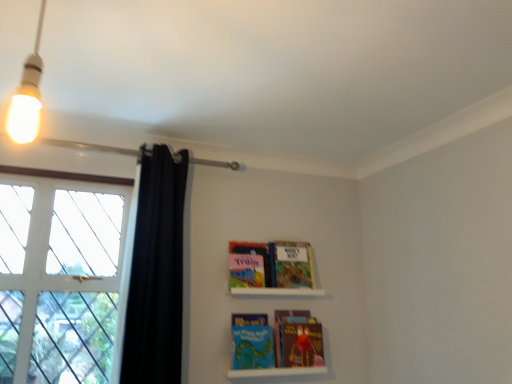
Question: Is matte plastic books at lower center, which appears as the first shelf when ordered from the bottom, far from multicolored paper at lower center, which is the first paperback book in bottom-to-top order?

Choices:
 (A) no
 (B) yes

Answer: (A)

Question: Does matte plastic books at lower center, which appears as the first shelf when ordered from the bottom, have a larger size compared to multicolored paper at lower center, which is the first paperback book in bottom-to-top order?

Choices:
 (A) no
 (B) yes

Answer: (A)

Question: Can you confirm if matte plastic books at lower center, placed as the second shelf when sorted from top to bottom, is taller than multicolored paper at lower center, acting as the fourth paperback book starting from the top?

Choices:
 (A) yes
 (B) no

Answer: (B)

Question: Considering the relative sizes of matte plastic books at lower center, which appears as the first shelf when ordered from the bottom, and multicolored paper at lower center, which is the first paperback book in bottom-to-top order, in the image provided, is matte plastic books at lower center, which appears as the first shelf when ordered from the bottom, smaller than multicolored paper at lower center, which is the first paperback book in bottom-to-top order,?

Choices:
 (A) yes
 (B) no

Answer: (A)

Question: Considering the relative sizes of matte plastic books at lower center, placed as the second shelf when sorted from top to bottom, and multicolored paper at lower center, which is the first paperback book in bottom-to-top order, in the image provided, is matte plastic books at lower center, placed as the second shelf when sorted from top to bottom, wider than multicolored paper at lower center, which is the first paperback book in bottom-to-top order,?

Choices:
 (A) no
 (B) yes

Answer: (B)

Question: Is matte blue book at center, which ranks as the fourth paperback book in bottom-to-top order, inside the boundaries of white matte shelf at upper center, the second shelf ordered from the bottom, or outside?

Choices:
 (A) inside
 (B) outside

Answer: (B)

Question: From the image's perspective, relative to white matte shelf at upper center, which is the 1th shelf from top to bottom, is matte blue book at center, which ranks as the 1th paperback book in top-to-bottom order, above or below?

Choices:
 (A) above
 (B) below

Answer: (A)

Question: From a real-world perspective, is matte blue book at center, which ranks as the 1th paperback book in top-to-bottom order, physically located above or below white matte shelf at upper center, the second shelf ordered from the bottom?

Choices:
 (A) below
 (B) above

Answer: (B)

Question: Relative to white matte shelf at upper center, which is the 1th shelf from top to bottom, is matte blue book at center, which ranks as the 1th paperback book in top-to-bottom order, in front or behind?

Choices:
 (A) front
 (B) behind

Answer: (B)

Question: From their relative heights in the image, would you say hardcover book at upper center, which is counted as the second paperback book, starting from the top, is taller or shorter than matte plastic books at lower center, which appears as the first shelf when ordered from the bottom?

Choices:
 (A) tall
 (B) short

Answer: (A)

Question: Is hardcover book at upper center, which is counted as the second paperback book, starting from the top, bigger or smaller than matte plastic books at lower center, which appears as the first shelf when ordered from the bottom?

Choices:
 (A) small
 (B) big

Answer: (B)

Question: Is hardcover book at upper center, which is counted as the 3th paperback book, starting from the bottom, spatially inside matte plastic books at lower center, placed as the second shelf when sorted from top to bottom, or outside of it?

Choices:
 (A) inside
 (B) outside

Answer: (B)

Question: Visually, is hardcover book at upper center, which is counted as the 3th paperback book, starting from the bottom, positioned to the left or to the right of matte plastic books at lower center, placed as the second shelf when sorted from top to bottom?

Choices:
 (A) left
 (B) right

Answer: (B)

Question: From a real-world perspective, relative to multicolored paper at lower center, acting as the fourth paperback book starting from the top, is matte blue book at center, which ranks as the fourth paperback book in bottom-to-top order, vertically above or below?

Choices:
 (A) below
 (B) above

Answer: (B)

Question: Is point (244, 258) closer or farther from the camera than point (302, 314)?

Choices:
 (A) closer
 (B) farther

Answer: (A)